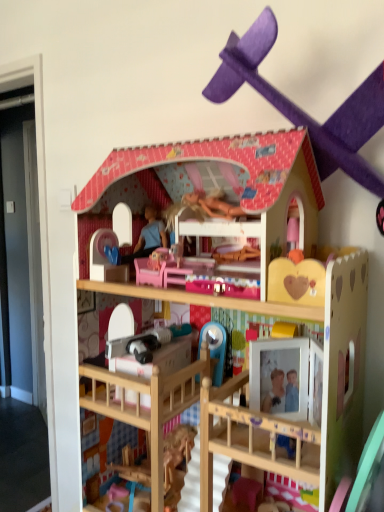
At what (x,y) coordinates should I click in order to perform the action: click on wooden dollhouse at center, which appears as the 1th toy when ordered from the bottom. Please return your answer as a coordinate pair (x, y). Looking at the image, I should click on (269, 276).

What is the approximate height of wooden dollhouse at center, which is the 2th toy from top to bottom?

35.71 inches.

Image resolution: width=384 pixels, height=512 pixels. Describe the element at coordinates (269, 276) in the screenshot. I see `wooden dollhouse at center, which appears as the 1th toy when ordered from the bottom` at that location.

In order to face purple cardboard airplane at upper center, the 2th toy from the bottom, should I rotate leftwards or rightwards?

To face it directly, rotate right by 13.479 degrees.

You are a GUI agent. You are given a task and a screenshot of the screen. Output one action in this format:
    pyautogui.click(x=<x>, y=<y>)
    Task: Click on the purple cardboard airplane at upper center, the 1th toy in the top-to-bottom sequence
    The image size is (384, 512).
    Given the screenshot: What is the action you would take?
    pyautogui.click(x=302, y=110)

This screenshot has height=512, width=384. Describe the element at coordinates (302, 110) in the screenshot. I see `purple cardboard airplane at upper center, the 2th toy from the bottom` at that location.

At what (x,y) coordinates should I click in order to perform the action: click on wooden dollhouse at center, which is the 2th toy from top to bottom. Please return your answer as a coordinate pair (x, y). This screenshot has height=512, width=384. Looking at the image, I should click on (269, 276).

Which object is positioned more to the right, wooden dollhouse at center, which appears as the 1th toy when ordered from the bottom, or purple cardboard airplane at upper center, the 2th toy from the bottom?

purple cardboard airplane at upper center, the 2th toy from the bottom.

Relative to purple cardboard airplane at upper center, the 2th toy from the bottom, is wooden dollhouse at center, which is the 2th toy from top to bottom, in front or behind?

Clearly, wooden dollhouse at center, which is the 2th toy from top to bottom, is behind purple cardboard airplane at upper center, the 2th toy from the bottom.

Considering the points (259, 236) and (317, 154), which point is in front, point (259, 236) or point (317, 154)?

The point (317, 154) is closer.

From the image's perspective, is wooden dollhouse at center, which appears as the 1th toy when ordered from the bottom, under purple cardboard airplane at upper center, the 1th toy in the top-to-bottom sequence?

Correct, wooden dollhouse at center, which appears as the 1th toy when ordered from the bottom, appears lower than purple cardboard airplane at upper center, the 1th toy in the top-to-bottom sequence, in the image.

From a real-world perspective, which object stands above the other?

purple cardboard airplane at upper center, the 2th toy from the bottom, is physically above.

Is wooden dollhouse at center, which appears as the 1th toy when ordered from the bottom, wider or thinner than purple cardboard airplane at upper center, the 1th toy in the top-to-bottom sequence?

Considering their sizes, wooden dollhouse at center, which appears as the 1th toy when ordered from the bottom, looks broader than purple cardboard airplane at upper center, the 1th toy in the top-to-bottom sequence.

Does wooden dollhouse at center, which is the 2th toy from top to bottom, have a greater height compared to purple cardboard airplane at upper center, the 1th toy in the top-to-bottom sequence?

Indeed, wooden dollhouse at center, which is the 2th toy from top to bottom, has a greater height compared to purple cardboard airplane at upper center, the 1th toy in the top-to-bottom sequence.

In terms of size, does wooden dollhouse at center, which appears as the 1th toy when ordered from the bottom, appear bigger or smaller than purple cardboard airplane at upper center, the 2th toy from the bottom?

Clearly, wooden dollhouse at center, which appears as the 1th toy when ordered from the bottom, is larger in size than purple cardboard airplane at upper center, the 2th toy from the bottom.

From the picture: Would you say wooden dollhouse at center, which appears as the 1th toy when ordered from the bottom, is outside purple cardboard airplane at upper center, the 1th toy in the top-to-bottom sequence?

wooden dollhouse at center, which appears as the 1th toy when ordered from the bottom, lies outside purple cardboard airplane at upper center, the 1th toy in the top-to-bottom sequence,'s area.

Is wooden dollhouse at center, which appears as the 1th toy when ordered from the bottom, beside purple cardboard airplane at upper center, the 2th toy from the bottom?

wooden dollhouse at center, which appears as the 1th toy when ordered from the bottom, and purple cardboard airplane at upper center, the 2th toy from the bottom, are not in contact.

Could you tell me if wooden dollhouse at center, which appears as the 1th toy when ordered from the bottom, is facing purple cardboard airplane at upper center, the 1th toy in the top-to-bottom sequence?

No, wooden dollhouse at center, which appears as the 1th toy when ordered from the bottom, is not facing towards purple cardboard airplane at upper center, the 1th toy in the top-to-bottom sequence.

How different are the orientations of wooden dollhouse at center, which appears as the 1th toy when ordered from the bottom, and purple cardboard airplane at upper center, the 1th toy in the top-to-bottom sequence, in degrees?

They differ by 1.58 degrees in their facing directions.

Image resolution: width=384 pixels, height=512 pixels. I want to click on toy in front of the wooden dollhouse at center, which is the 2th toy from top to bottom, so click(x=302, y=110).

Does purple cardboard airplane at upper center, the 2th toy from the bottom, appear on the left side of wooden dollhouse at center, which is the 2th toy from top to bottom?

No, purple cardboard airplane at upper center, the 2th toy from the bottom, is not to the left of wooden dollhouse at center, which is the 2th toy from top to bottom.

Considering the positions of objects purple cardboard airplane at upper center, the 2th toy from the bottom, and wooden dollhouse at center, which appears as the 1th toy when ordered from the bottom, in the image provided, who is in front, purple cardboard airplane at upper center, the 2th toy from the bottom, or wooden dollhouse at center, which appears as the 1th toy when ordered from the bottom,?

purple cardboard airplane at upper center, the 2th toy from the bottom.

Which point is more distant from viewer, [359,88] or [347,446]?

Positioned behind is point [347,446].

From the image's perspective, relative to wooden dollhouse at center, which appears as the 1th toy when ordered from the bottom, is purple cardboard airplane at upper center, the 1th toy in the top-to-bottom sequence, above or below?

Clearly, from the image's perspective, purple cardboard airplane at upper center, the 1th toy in the top-to-bottom sequence, is above wooden dollhouse at center, which appears as the 1th toy when ordered from the bottom.

From a real-world perspective, is purple cardboard airplane at upper center, the 1th toy in the top-to-bottom sequence, on wooden dollhouse at center, which appears as the 1th toy when ordered from the bottom?

Yes, from a real-world perspective, purple cardboard airplane at upper center, the 1th toy in the top-to-bottom sequence, is above wooden dollhouse at center, which appears as the 1th toy when ordered from the bottom.

Considering the sizes of objects purple cardboard airplane at upper center, the 1th toy in the top-to-bottom sequence, and wooden dollhouse at center, which is the 2th toy from top to bottom, in the image provided, who is thinner, purple cardboard airplane at upper center, the 1th toy in the top-to-bottom sequence, or wooden dollhouse at center, which is the 2th toy from top to bottom,?

With smaller width is purple cardboard airplane at upper center, the 1th toy in the top-to-bottom sequence.

Which of these two, purple cardboard airplane at upper center, the 2th toy from the bottom, or wooden dollhouse at center, which appears as the 1th toy when ordered from the bottom, stands shorter?

Standing shorter between the two is purple cardboard airplane at upper center, the 2th toy from the bottom.

Looking at this image, considering the sizes of objects purple cardboard airplane at upper center, the 1th toy in the top-to-bottom sequence, and wooden dollhouse at center, which is the 2th toy from top to bottom, in the image provided, who is smaller, purple cardboard airplane at upper center, the 1th toy in the top-to-bottom sequence, or wooden dollhouse at center, which is the 2th toy from top to bottom,?

Smaller between the two is purple cardboard airplane at upper center, the 1th toy in the top-to-bottom sequence.

Consider the image. Is purple cardboard airplane at upper center, the 1th toy in the top-to-bottom sequence, not inside wooden dollhouse at center, which is the 2th toy from top to bottom?

Yes, purple cardboard airplane at upper center, the 1th toy in the top-to-bottom sequence, is outside of wooden dollhouse at center, which is the 2th toy from top to bottom.

Is purple cardboard airplane at upper center, the 1th toy in the top-to-bottom sequence, touching wooden dollhouse at center, which appears as the 1th toy when ordered from the bottom?

No, purple cardboard airplane at upper center, the 1th toy in the top-to-bottom sequence, is not touching wooden dollhouse at center, which appears as the 1th toy when ordered from the bottom.

Is purple cardboard airplane at upper center, the 2th toy from the bottom, positioned with its back to wooden dollhouse at center, which is the 2th toy from top to bottom?

No, purple cardboard airplane at upper center, the 2th toy from the bottom,'s orientation is not away from wooden dollhouse at center, which is the 2th toy from top to bottom.

Can you tell me how much purple cardboard airplane at upper center, the 2th toy from the bottom, and wooden dollhouse at center, which appears as the 1th toy when ordered from the bottom, differ in facing direction?

The angle between the facing direction of purple cardboard airplane at upper center, the 2th toy from the bottom, and the facing direction of wooden dollhouse at center, which appears as the 1th toy when ordered from the bottom, is 1.58 degrees.

Identify the location of toy above the wooden dollhouse at center, which is the 2th toy from top to bottom (from the image's perspective). (302, 110).

The height and width of the screenshot is (512, 384). Identify the location of toy behind the purple cardboard airplane at upper center, the 2th toy from the bottom. (269, 276).

Identify the location of toy located above the wooden dollhouse at center, which is the 2th toy from top to bottom (from a real-world perspective). (302, 110).